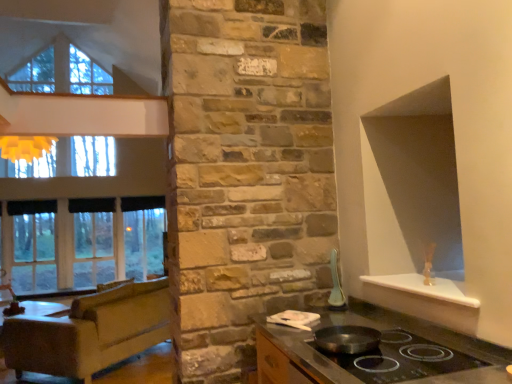
What do you see at coordinates (336, 285) in the screenshot?
I see `white glossy spoon at upper right` at bounding box center [336, 285].

The image size is (512, 384). What do you see at coordinates (377, 353) in the screenshot?
I see `shiny black countertop at lower center` at bounding box center [377, 353].

This screenshot has width=512, height=384. Describe the element at coordinates (88, 224) in the screenshot. I see `clear glass window at left` at that location.

The height and width of the screenshot is (384, 512). Describe the element at coordinates (91, 205) in the screenshot. I see `black fabric curtain at left, the second curtain when ordered from left to right` at that location.

Locate an element on the screen. The image size is (512, 384). shiny black wok at center is located at coordinates (347, 339).

Find the location of a particular element. This screenshot has width=512, height=384. white glossy spoon at upper right is located at coordinates (336, 285).

Which is nearer, (108, 201) or (336, 274)?

Point (108, 201) is farther from the camera than point (336, 274).

From a real-world perspective, is black fabric curtain at left, arranged as the 1th curtain when viewed from the back, located beneath white glossy spoon at upper right?

No, from a real-world perspective, black fabric curtain at left, arranged as the 1th curtain when viewed from the back, is not under white glossy spoon at upper right.

In the image, is black fabric curtain at left, the 2th curtain in the front-to-back sequence, positioned in front of or behind white glossy spoon at upper right?

In the image, black fabric curtain at left, the 2th curtain in the front-to-back sequence, appears behind white glossy spoon at upper right.

From the image's perspective, which one is positioned higher, white glossy spoon at upper right or brown leather couch at left?

From the image's view, white glossy spoon at upper right is above.

Considering the relative sizes of white glossy spoon at upper right and brown leather couch at left in the image provided, is white glossy spoon at upper right shorter than brown leather couch at left?

Indeed, white glossy spoon at upper right has a lesser height compared to brown leather couch at left.

Considering the sizes of objects white glossy spoon at upper right and brown leather couch at left in the image provided, who is thinner, white glossy spoon at upper right or brown leather couch at left?

With smaller width is white glossy spoon at upper right.

Which object is positioned more to the left, white glossy spoon at upper right or brown leather couch at left?

Positioned to the left is brown leather couch at left.

Looking at their sizes, would you say brown leather couch at left is wider or thinner than white glossy spoon at upper right?

Clearly, brown leather couch at left has more width compared to white glossy spoon at upper right.

How much distance is there between brown leather couch at left and white glossy spoon at upper right?

brown leather couch at left is 2.54 meters away from white glossy spoon at upper right.

Is brown leather couch at left positioned with its back to white glossy spoon at upper right?

Yes, brown leather couch at left is positioned with its back facing white glossy spoon at upper right.

Is the position of brown leather couch at left less distant than that of white glossy spoon at upper right?

No, brown leather couch at left is further to the viewer.

Which is behind, point (341, 302) or point (152, 142)?

The point (152, 142) is behind.

From the image's perspective, does white glossy spoon at upper right appear higher than clear glass window at left?

Yes.

Is white glossy spoon at upper right located outside clear glass window at left?

Yes, white glossy spoon at upper right is not within clear glass window at left.

At what (x,y) coordinates should I click in order to perform the action: click on appliance in front of the clear glass window at left. Please return your answer as a coordinate pair (x, y). The image size is (512, 384). Looking at the image, I should click on (336, 285).

Can we say black fabric curtain at left, acting as the 1th curtain starting from the left, lies outside shiny black countertop at lower center?

black fabric curtain at left, acting as the 1th curtain starting from the left, is positioned outside shiny black countertop at lower center.

From a real-world perspective, is black fabric curtain at left, acting as the second curtain starting from the right, located higher than shiny black countertop at lower center?

Yes, from a real-world perspective, black fabric curtain at left, acting as the second curtain starting from the right, is over shiny black countertop at lower center

Is black fabric curtain at left, which is counted as the 1th curtain, starting from the front, in contact with shiny black countertop at lower center?

black fabric curtain at left, which is counted as the 1th curtain, starting from the front, and shiny black countertop at lower center are not in contact.

Based on the photo, considering the positions of objects black fabric curtain at left, acting as the 1th curtain starting from the left, and shiny black countertop at lower center in the image provided, who is behind, black fabric curtain at left, acting as the 1th curtain starting from the left, or shiny black countertop at lower center?

black fabric curtain at left, acting as the 1th curtain starting from the left, is further from the camera.

Is clear glass window at left to the right of shiny black wok at center from the viewer's perspective?

No.

Measure the distance between clear glass window at left and shiny black wok at center.

9.45 feet.

Which object is wider, clear glass window at left or shiny black wok at center?

shiny black wok at center.

Is clear glass window at left taller or shorter than shiny black wok at center?

Considering their sizes, clear glass window at left has more height than shiny black wok at center.

Could you tell me if shiny black wok at center is facing clear glass window at left?

No, shiny black wok at center is not facing towards clear glass window at left.

Does shiny black wok at center contain clear glass window at left?

No, shiny black wok at center does not contain clear glass window at left.

Which is nearer, (319,333) or (142,260)?

The point (319,333) is in front.

Does shiny black wok at center appear on the left side of clear glass window at left?

No, shiny black wok at center is not to the left of clear glass window at left.

This screenshot has width=512, height=384. Identify the location of the 2nd curtain positioned above the white glossy spoon at upper right (from a real-world perspective). (91, 205).

What are the coordinates of `appliance in front of the brown leather couch at left` in the screenshot? It's located at (336, 285).

From the image, which object appears to be nearer to shiny black wok at center, brown leather couch at left or white glossy spoon at upper right?

white glossy spoon at upper right is positioned closer to the anchor shiny black wok at center.

From the image, which object appears to be farther from black fabric curtain at left, acting as the second curtain starting from the right, white glossy spoon at upper right or shiny black wok at center?

shiny black wok at center is further to black fabric curtain at left, acting as the second curtain starting from the right.

Considering their positions, is shiny black countertop at lower center positioned closer to white glossy spoon at upper right than black fabric curtain at left, the 2th curtain in the front-to-back sequence?

shiny black countertop at lower center is closer to white glossy spoon at upper right.

Estimate the real-world distances between objects in this image. Which object is further from shiny black countertop at lower center, shiny black wok at center or brown leather couch at left?

brown leather couch at left lies further to shiny black countertop at lower center than the other object.

Considering their positions, is clear glass window at left positioned further to shiny black wok at center than black fabric curtain at left, the 2th curtain viewed from the back?

Based on the image, black fabric curtain at left, the 2th curtain viewed from the back, appears to be further to shiny black wok at center.

When comparing their distances from white glossy spoon at upper right, does clear glass window at left or black fabric curtain at left, the 2th curtain in the front-to-back sequence, seem closer?

black fabric curtain at left, the 2th curtain in the front-to-back sequence, lies closer to white glossy spoon at upper right than the other object.

Estimate the real-world distances between objects in this image. Which object is further from shiny black wok at center, clear glass window at left or white glossy spoon at upper right?

Among the two, clear glass window at left is located further to shiny black wok at center.

Looking at this image, from the image, which object appears to be nearer to white glossy spoon at upper right, shiny black wok at center or black fabric curtain at left, the 2th curtain in the front-to-back sequence?

shiny black wok at center is positioned closer to the anchor white glossy spoon at upper right.

The height and width of the screenshot is (384, 512). What are the coordinates of `appliance between shiny black countertop at lower center and clear glass window at left from front to back` in the screenshot? It's located at (336, 285).

The height and width of the screenshot is (384, 512). I want to click on appliance positioned between shiny black wok at center and black fabric curtain at left, the 2th curtain viewed from the back, from near to far, so click(x=336, y=285).

Find the location of a particular element. wok between brown leather couch at left and white glossy spoon at upper right is located at coordinates (347, 339).

Find the location of a particular element. This screenshot has width=512, height=384. wok between shiny black countertop at lower center and black fabric curtain at left, which is the first curtain from right to left, in the front-back direction is located at coordinates (347, 339).